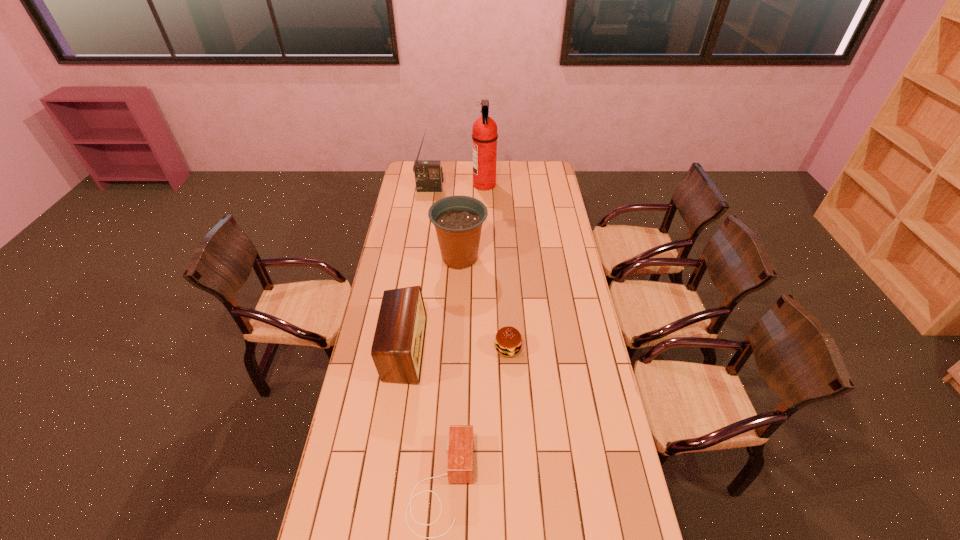
This screenshot has height=540, width=960. In order to click on empty space between the tallest radio receiver and the shortest radio receiver in this screenshot , I will do `click(436, 337)`.

At what (x,y) coordinates should I click in order to perform the action: click on vacant area that lies between the third tallest object and the second nearest radio receiver. Please return your answer as a coordinate pair (x, y). This screenshot has width=960, height=540. Looking at the image, I should click on (432, 303).

The width and height of the screenshot is (960, 540). In order to click on object that is the fourth closest one to the flowerpot in this screenshot , I will do `click(428, 174)`.

Where is `object that is the second nearest to the second tallest object`? The height and width of the screenshot is (540, 960). object that is the second nearest to the second tallest object is located at coordinates (458, 220).

Where is `radio receiver object that ranks as the third closest to the fire extinguisher`? radio receiver object that ranks as the third closest to the fire extinguisher is located at coordinates (459, 446).

Find the location of a particular element. The image size is (960, 540). the third closest radio receiver to the tallest object is located at coordinates (459, 446).

The image size is (960, 540). In order to click on free space that satisfies the following two spatial constraints: 1. on the display of the third farthest object; 2. on the right side of the farthest radio receiver in this screenshot , I will do `click(420, 258)`.

The image size is (960, 540). What are the coordinates of `free spot that satisfies the following two spatial constraints: 1. on the side of the fire extinguisher near the handle; 2. on the front side of the third farthest object` in the screenshot? It's located at (486, 258).

Image resolution: width=960 pixels, height=540 pixels. What are the coordinates of `free point that satisfies the following two spatial constraints: 1. on the display of the hamburger; 2. on the right side of the tallest radio receiver` in the screenshot? It's located at coord(407,348).

Find the location of a particular element. The height and width of the screenshot is (540, 960). vacant space that satisfies the following two spatial constraints: 1. on the display of the tallest radio receiver; 2. on the right side of the flowerpot is located at coordinates (420, 258).